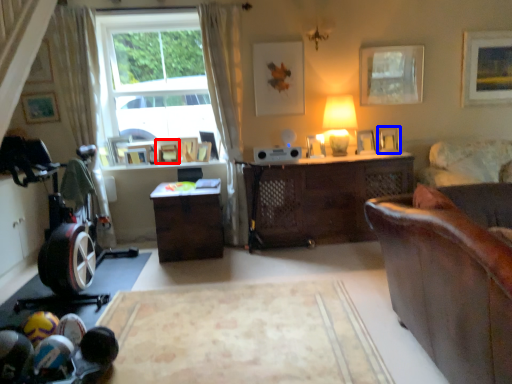
Question: Which object appears farthest to the camera in this image, picture frame (highlighted by a red box) or picture frame (highlighted by a blue box)?

Choices:
 (A) picture frame
 (B) picture frame

Answer: (A)